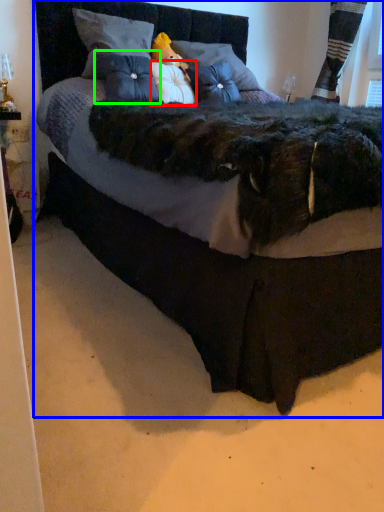
Question: Which object is positioned closest to pillow (highlighted by a red box)? Select from bed (highlighted by a blue box) and pillow (highlighted by a green box).

Choices:
 (A) bed
 (B) pillow

Answer: (B)